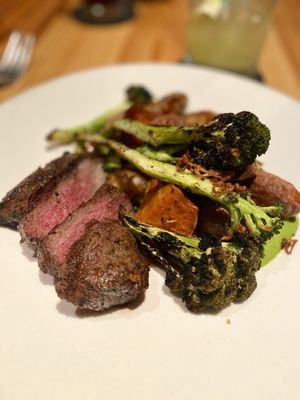
Where is `fork`? The image size is (300, 400). fork is located at coordinates (11, 70).